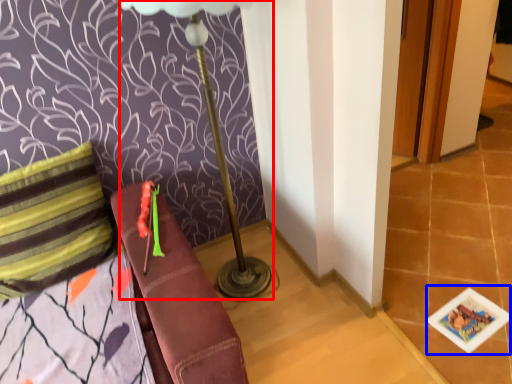
Question: Which point is closer to the camera, table lamp (highlighted by a red box) or card game (highlighted by a blue box)?

Choices:
 (A) table lamp
 (B) card game

Answer: (A)